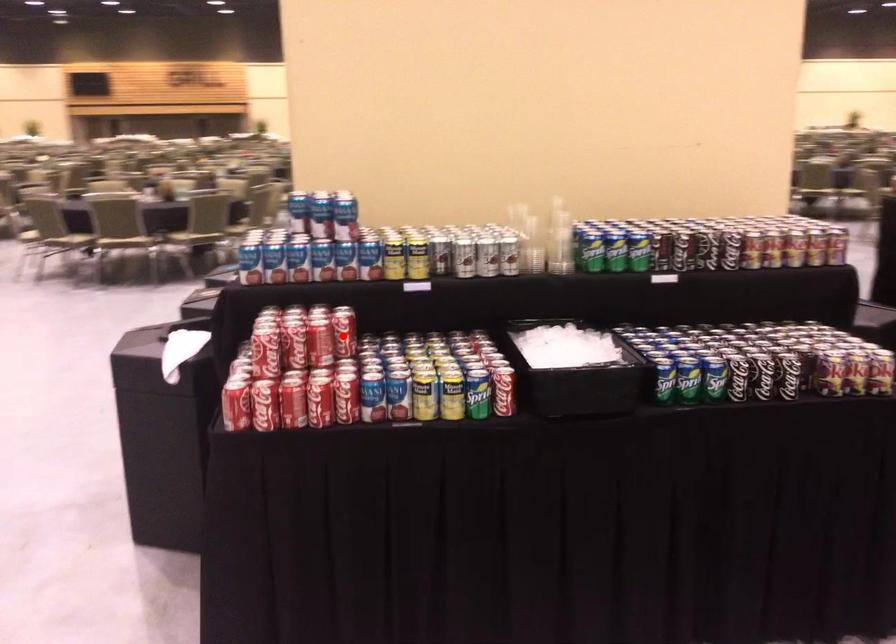
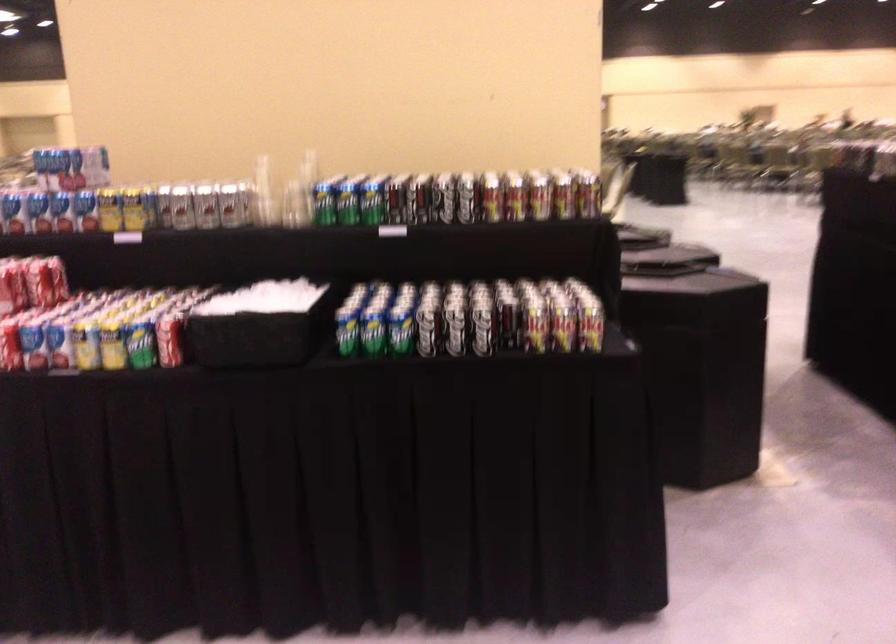
In the second image, find the point that corresponds to the highlighted location in the first image.

(40, 283)